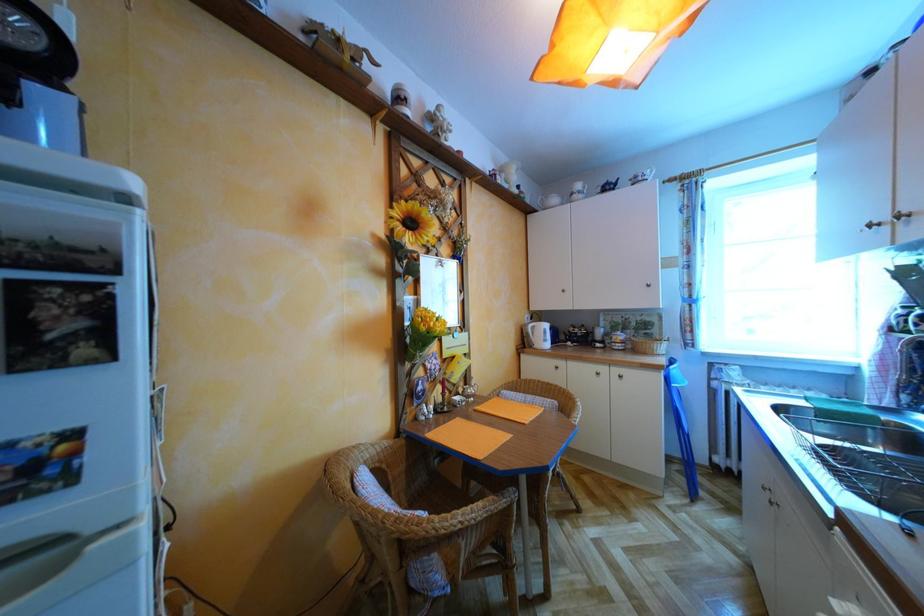
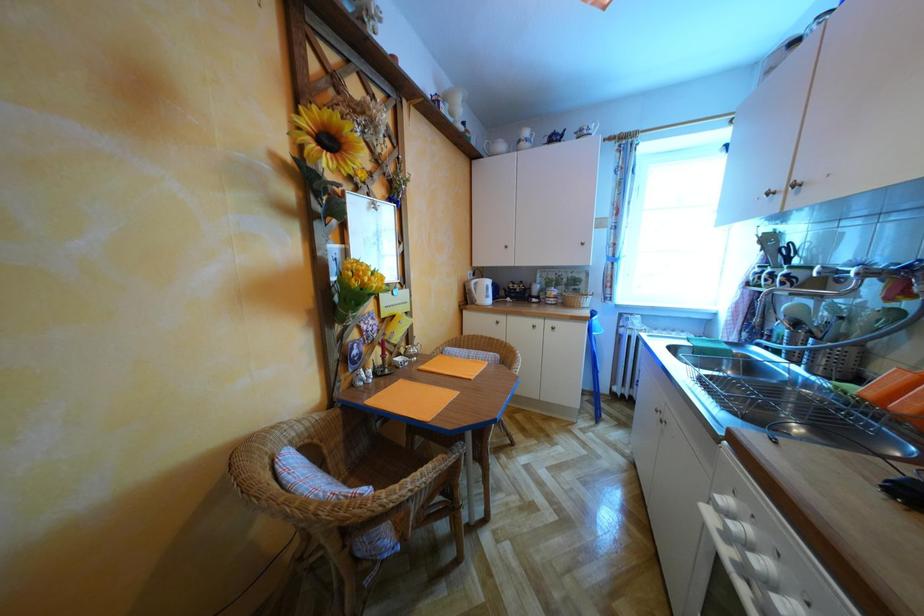
Question: Based on the continuous images, in which direction is the camera rotating? Reply with the corresponding letter.

Choices:
 (A) Left
 (B) Right
 (C) Up
 (D) Down

Answer: (B)